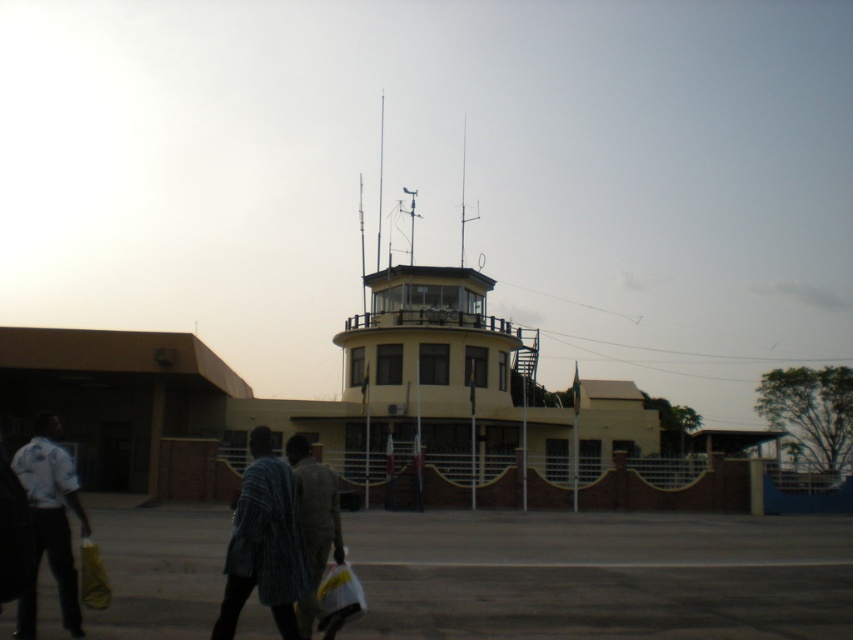
Question: Which of the following is the farthest from the observer?

Choices:
 (A) white uniform at left
 (B) striped fabric couple at center
 (C) light brown fabric jacket at center

Answer: (C)

Question: Which of these objects is positioned farthest from the white uniform at left?

Choices:
 (A) striped fabric couple at center
 (B) light brown fabric jacket at center

Answer: (B)

Question: Does white uniform at left have a lesser width compared to light brown fabric jacket at center?

Choices:
 (A) yes
 (B) no

Answer: (B)

Question: Can you confirm if striped fabric couple at center is positioned to the left of light brown fabric jacket at center?

Choices:
 (A) no
 (B) yes

Answer: (B)

Question: Is striped fabric couple at center to the right of white uniform at left from the viewer's perspective?

Choices:
 (A) yes
 (B) no

Answer: (A)

Question: Which object is closer to the camera taking this photo?

Choices:
 (A) striped fabric couple at center
 (B) light brown fabric jacket at center

Answer: (A)